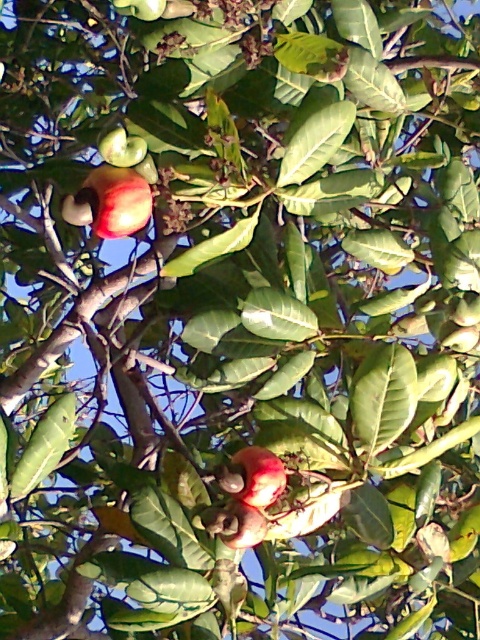
Question: Which object appears closest to the camera in this image?

Choices:
 (A) shiny red apple at center
 (B) shiny red apple at upper center
 (C) shiny red apple at upper left

Answer: (B)

Question: Does shiny red apple at upper left lie in front of shiny red apple at upper center?

Choices:
 (A) no
 (B) yes

Answer: (A)

Question: Which point is closer to the camera?

Choices:
 (A) shiny red apple at upper center
 (B) shiny red apple at center

Answer: (A)

Question: Does shiny red apple at upper left appear on the left side of shiny red apple at upper center?

Choices:
 (A) yes
 (B) no

Answer: (A)

Question: Does shiny red apple at upper left come in front of shiny red apple at center?

Choices:
 (A) yes
 (B) no

Answer: (A)

Question: Which point appears farthest from the camera in this image?

Choices:
 (A) (158, 1)
 (B) (105, 196)

Answer: (B)